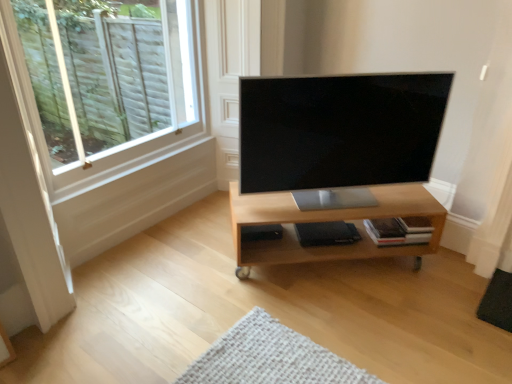
Question: Considering the positions of point (336, 254) and point (72, 127), is point (336, 254) closer or farther from the camera than point (72, 127)?

Choices:
 (A) closer
 (B) farther

Answer: (A)

Question: From a real-world perspective, is light wood shelf at center physically located above or below white wood window at upper left?

Choices:
 (A) above
 (B) below

Answer: (B)

Question: Which object is the closest to the satin black tv at center?

Choices:
 (A) light wood shelf at center
 (B) white wood window at upper left

Answer: (A)

Question: Which is farther from the light wood shelf at center?

Choices:
 (A) satin black tv at center
 (B) white wood window at upper left

Answer: (B)